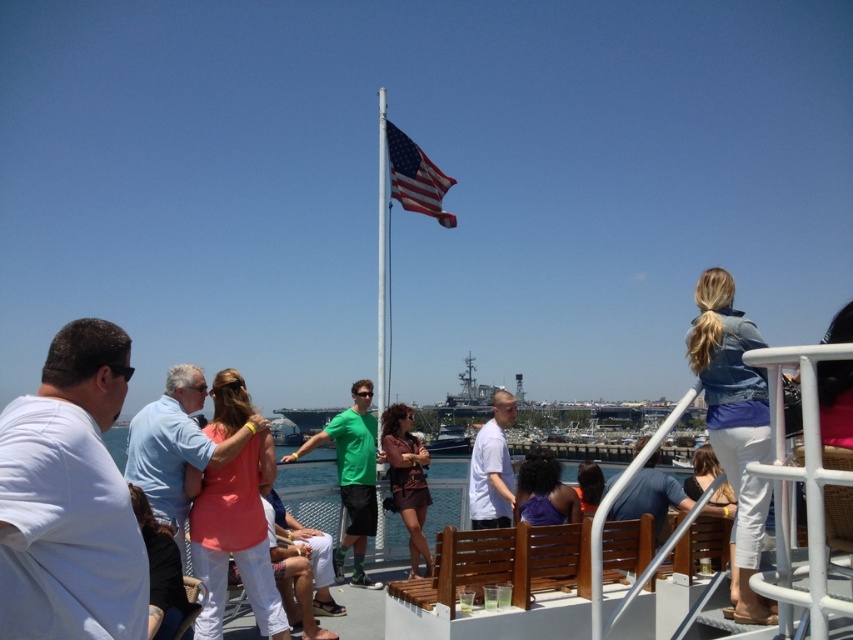
Question: Among these objects, which one is farthest from the camera?

Choices:
 (A) matte black shirt at center
 (B) white matte shirt at center
 (C) white matte shirt at left
 (D) green matte shirt at center

Answer: (A)

Question: Is silver metallic flag pole at center positioned before matte black shirt at center?

Choices:
 (A) no
 (B) yes

Answer: (A)

Question: Among these objects, which one is farthest from the camera?

Choices:
 (A) purple matte shirt at center
 (B) green matte shirt at center
 (C) brown leather jacket at center
 (D) denim jacket at upper right

Answer: (C)

Question: Can you confirm if white matte shirt at center is positioned below purple matte shirt at center?

Choices:
 (A) no
 (B) yes

Answer: (A)

Question: Can you confirm if coral fabric shirt at center is bigger than light blue shirt at center?

Choices:
 (A) no
 (B) yes

Answer: (B)

Question: Estimate the real-world distances between objects in this image. Which object is farther from the denim jacket at upper right?

Choices:
 (A) matte black shirt at center
 (B) white matte shirt at left
 (C) silver metallic flag pole at center
 (D) light blue shirt at center

Answer: (C)